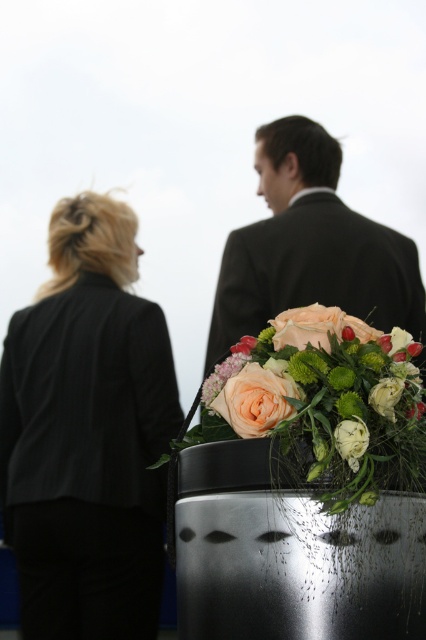
You are a photographer trying to capture a clear shot of the matte peach rose at center without the black fabric jacket at left blocking it. Based on their heights, can you position yourself lower to the ground to avoid the jacket blocking the view?

The black fabric jacket at left is taller than the matte peach rose at center, so positioning yourself lower to the ground might help avoid the jacket blocking the view of the rose.

From the picture: You are a photographer trying to capture the two people in the scene. You notice two specific points in the image labeled as point (6, 483) and point (319, 330). Which point is closer to your camera?

Point (6, 483) is closer to the camera than point (319, 330).